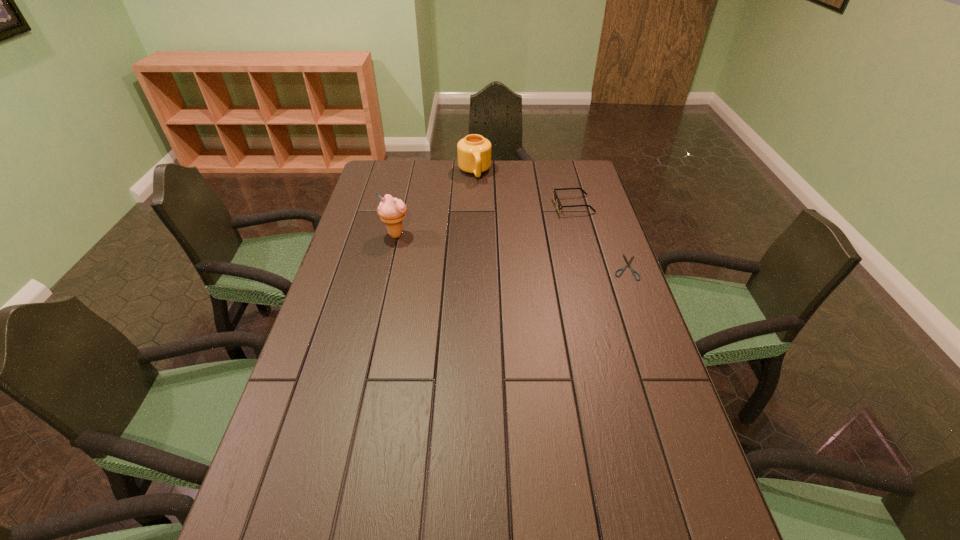
Where is `free point located 0.250m on the lenses of the third nearest object`? This screenshot has width=960, height=540. free point located 0.250m on the lenses of the third nearest object is located at coordinates (503, 233).

The image size is (960, 540). Find the location of `free space located on the lenses of the third nearest object`. free space located on the lenses of the third nearest object is located at coordinates (469, 247).

The width and height of the screenshot is (960, 540). I want to click on free region located 0.320m on the lenses of the third nearest object, so click(487, 240).

Image resolution: width=960 pixels, height=540 pixels. In order to click on free location located on the handle side of the second tallest object in this screenshot , I will do `click(483, 209)`.

This screenshot has height=540, width=960. Identify the location of vacant space located 0.090m on the handle side of the second tallest object. (480, 196).

Locate an element on the screen. The height and width of the screenshot is (540, 960). vacant space located 0.270m on the handle side of the second tallest object is located at coordinates (487, 224).

Where is `object at the far edge`? This screenshot has width=960, height=540. object at the far edge is located at coordinates (474, 151).

You are a GUI agent. You are given a task and a screenshot of the screen. Output one action in this format:
    pyautogui.click(x=<x>, y=<y>)
    Task: Click on the object positioned at the left edge
    
    Given the screenshot: What is the action you would take?
    pyautogui.click(x=391, y=210)

In order to click on shears that is positioned at the right edge in this screenshot , I will do `click(628, 263)`.

Where is `sunglasses present at the right edge`? sunglasses present at the right edge is located at coordinates (556, 198).